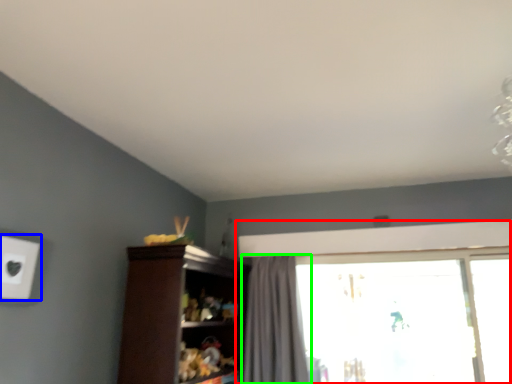
Question: Based on their relative distances, which object is farther from window (highlighted by a red box)? Choose from electric outlet (highlighted by a blue box) and curtain (highlighted by a green box).

Choices:
 (A) electric outlet
 (B) curtain

Answer: (A)